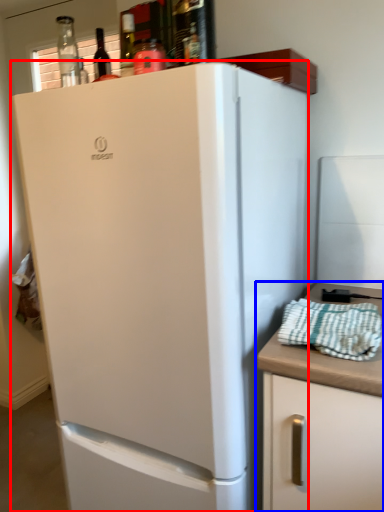
Question: Which of the following is the closest to the observer, refrigerator (highlighted by a red box) or cabinetry (highlighted by a blue box)?

Choices:
 (A) refrigerator
 (B) cabinetry

Answer: (A)